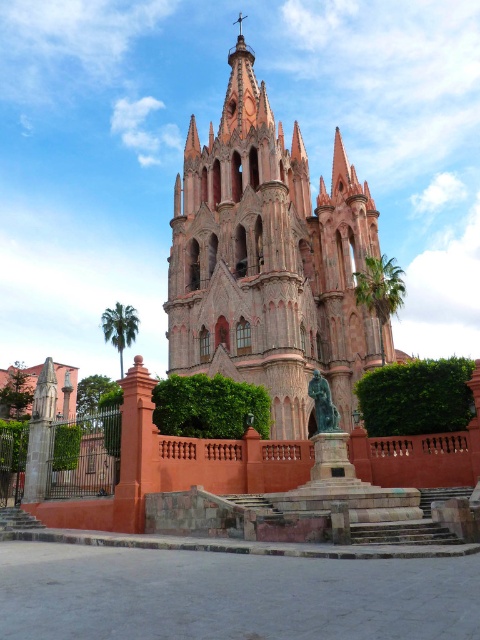
Is red brick church at center bigger than bronze statue at center?

Indeed, red brick church at center has a larger size compared to bronze statue at center.

Who is shorter, red brick church at center or bronze statue at center?

bronze statue at center is shorter.

Between point (280, 330) and point (331, 416), which one is positioned behind?

The point (280, 330) is behind.

At what (x,y) coordinates should I click in order to perform the action: click on red brick church at center. Please return your answer as a coordinate pair (x, y). The image size is (480, 640). Looking at the image, I should click on (269, 260).